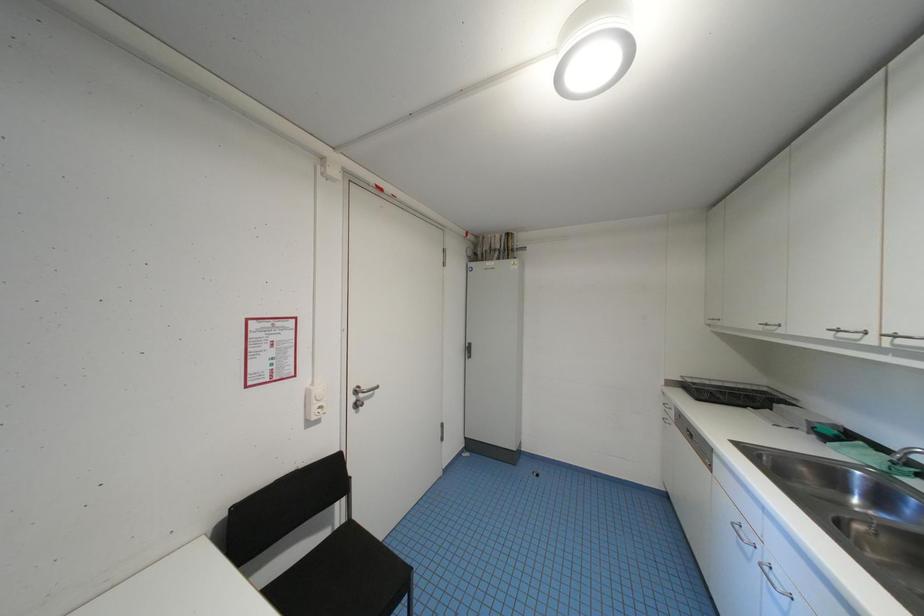
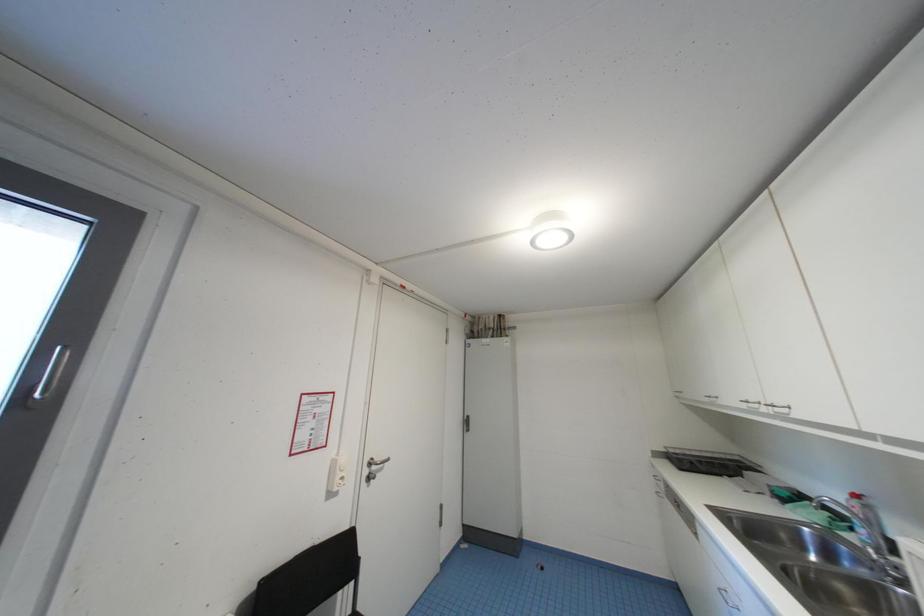
Question: In a continuous first-person perspective shot, in which direction is the camera moving?

Choices:
 (A) Left
 (B) Right
 (C) Forward
 (D) Backward

Answer: (D)